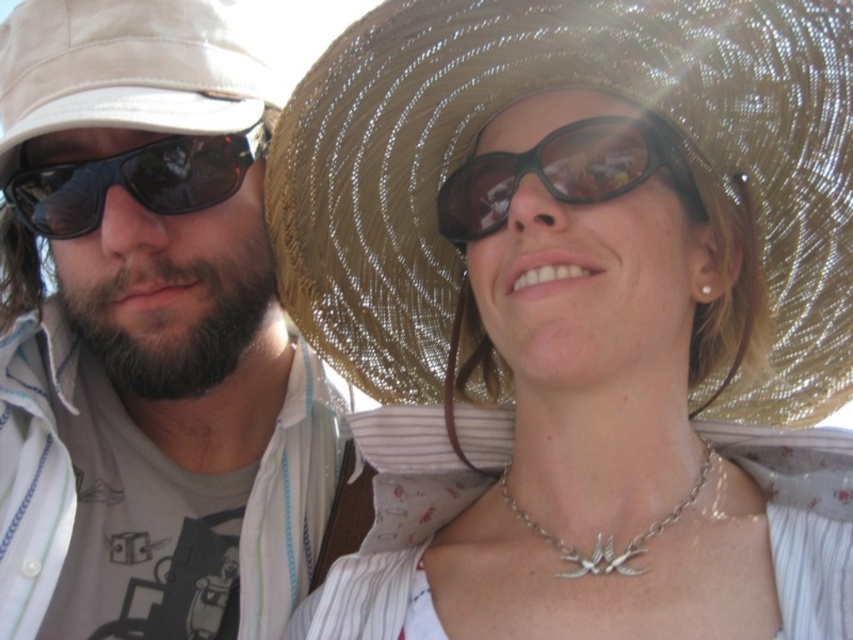
Question: Among these points, which one is nearest to the camera?

Choices:
 (A) (572, 560)
 (B) (606, 150)
 (C) (251, 584)
 (D) (171, 212)

Answer: (B)

Question: Is black plastic sunglasses at center bigger than silver metallic necklace at center?

Choices:
 (A) no
 (B) yes

Answer: (B)

Question: Among these points, which one is nearest to the camera?

Choices:
 (A) (68, 621)
 (B) (125, 168)

Answer: (B)

Question: Which is farther from the matte white hat at left?

Choices:
 (A) beige fabric cowboy hat at left
 (B) black plastic sunglasses at center
 (C) woven straw hat at upper center
 (D) silver metallic necklace at center

Answer: (D)

Question: Is woven straw hat at upper center to the left of matte black sunglasses at left from the viewer's perspective?

Choices:
 (A) no
 (B) yes

Answer: (A)

Question: Is woven straw hat at upper center to the right of silver metallic necklace at center from the viewer's perspective?

Choices:
 (A) yes
 (B) no

Answer: (B)